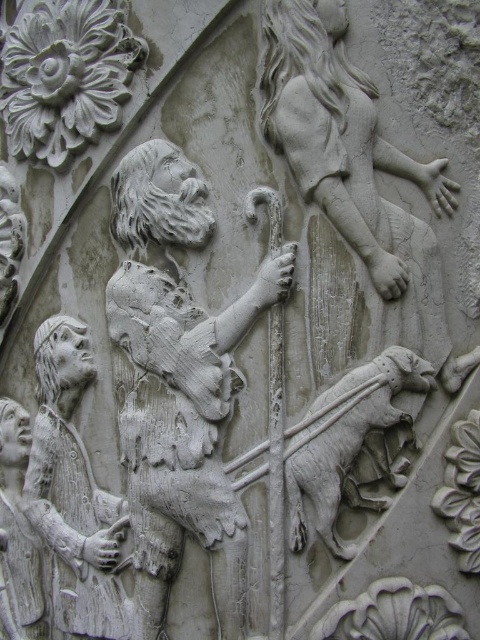
You are an art conservator examining the stone relief sculpture. You notice two points of interest marked at coordinates point (188, 196) and point (386, 408). Which point is closer to the viewer?

Point (188, 196) is further to the camera than point (386, 408). Therefore, point (386, 408) is closer to the viewer.

You are an art historian examining this relief sculpture. You notice the white stone shepherd at lower left and the white stone lion at center. Based on their positions, which object is positioned to the left of the other?

The white stone shepherd at lower left is to the left of the white stone lion at center.

From the picture: You are an art conservator examining the stone relief sculpture. You notice the white stone shepherd at center and the white stone shepherd at lower left. Which shepherd appears larger in size?

The white stone shepherd at center is much taller than the white stone shepherd at lower left, making it appear larger in size.